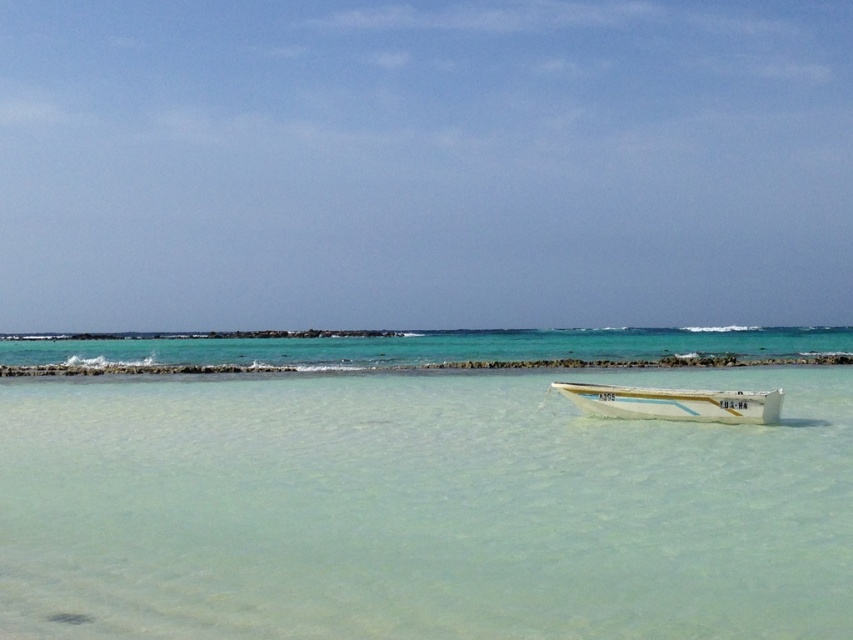
Does point (262, 417) lie in front of point (637, 401)?

No, (262, 417) is behind (637, 401).

Where is `clear water at boat right`? clear water at boat right is located at coordinates (421, 509).